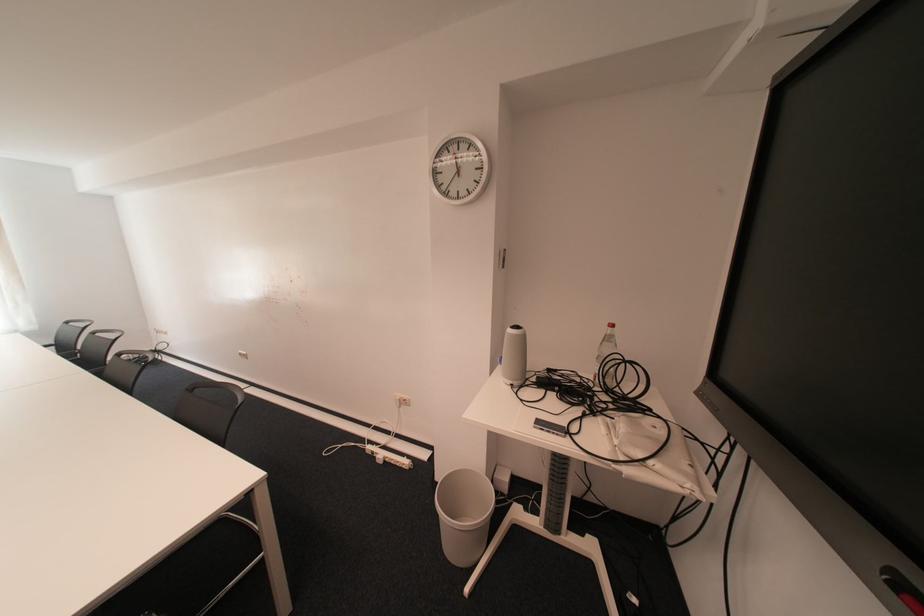
The width and height of the screenshot is (924, 616). Describe the element at coordinates (402, 400) in the screenshot. I see `the wall power outlet` at that location.